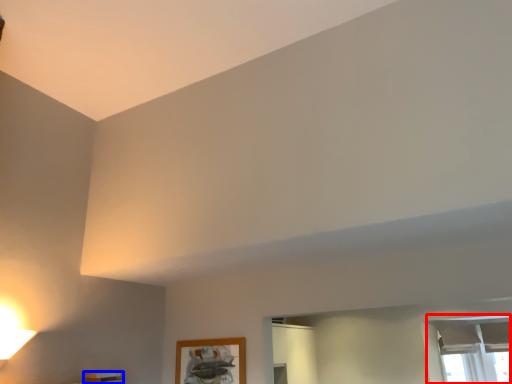
Question: Which object appears closest to the camera in this image, window (highlighted by a red box) or furniture (highlighted by a blue box)?

Choices:
 (A) window
 (B) furniture

Answer: (B)